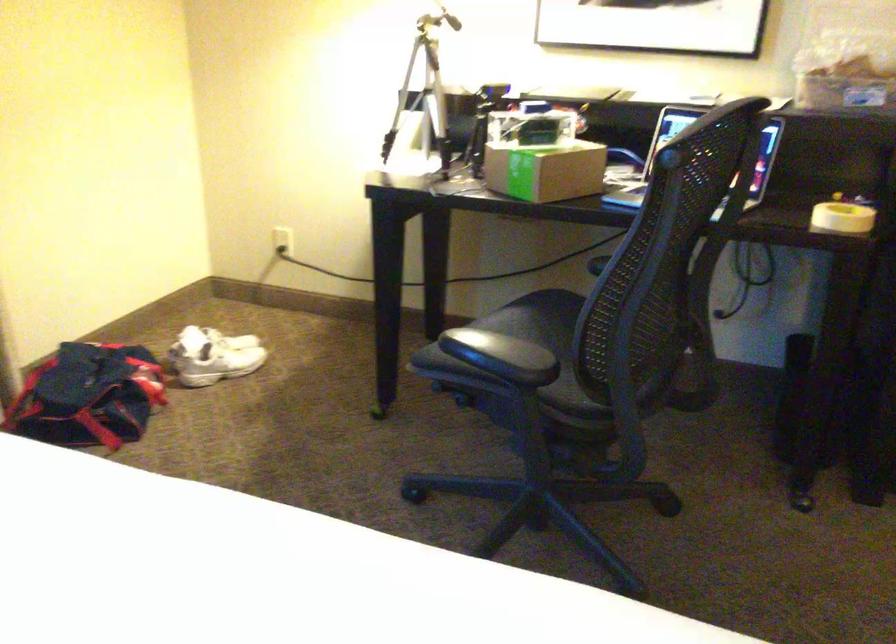
The location [545,169] corresponds to which object?

It refers to a cardboard box.